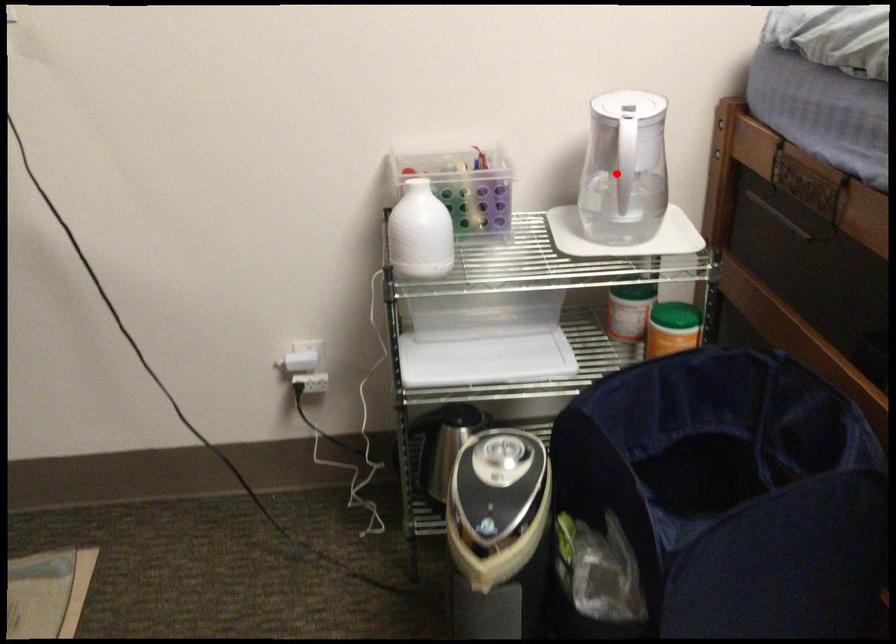
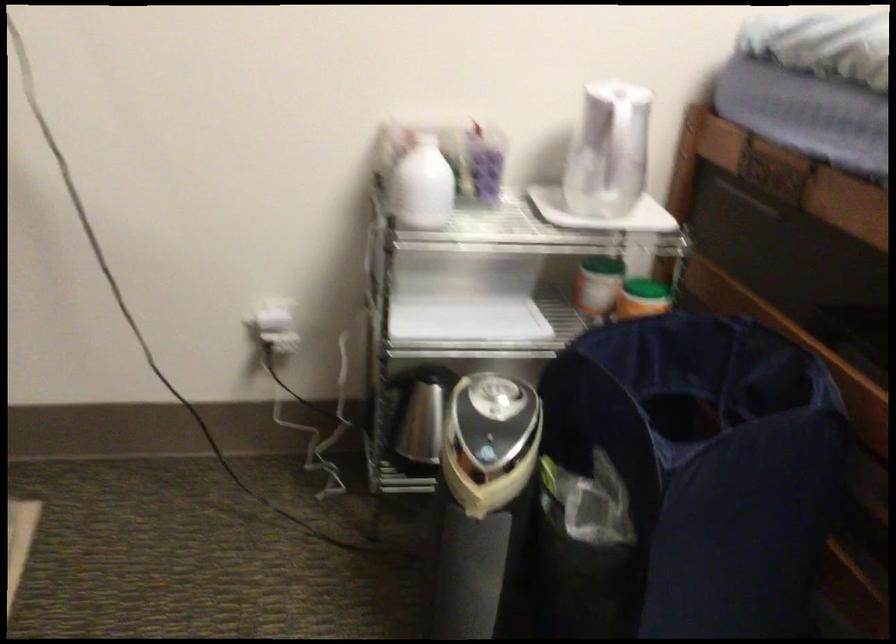
Find the pixel in the second image that matches the highlighted location in the first image.

(607, 151)